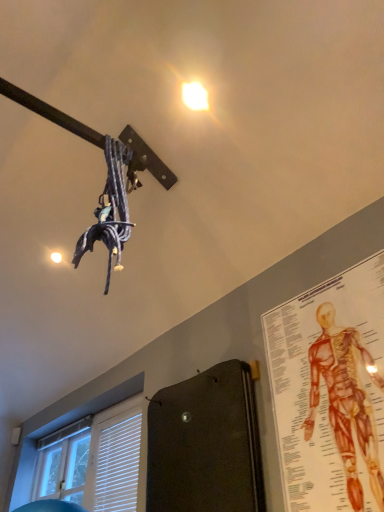
Question: Is white glossy droplight at upper center positioned in front of anatomical chart at upper right?

Choices:
 (A) no
 (B) yes

Answer: (A)

Question: From a real-world perspective, does white glossy droplight at upper center stand above anatomical chart at upper right?

Choices:
 (A) no
 (B) yes

Answer: (B)

Question: Is white glossy droplight at upper center wider than anatomical chart at upper right?

Choices:
 (A) yes
 (B) no

Answer: (A)

Question: Is white glossy droplight at upper center to the right of anatomical chart at upper right from the viewer's perspective?

Choices:
 (A) yes
 (B) no

Answer: (B)

Question: Considering the relative sizes of white glossy droplight at upper center and anatomical chart at upper right in the image provided, is white glossy droplight at upper center shorter than anatomical chart at upper right?

Choices:
 (A) yes
 (B) no

Answer: (A)

Question: Considering the positions of anatomical chart at upper right and white glossy droplight at upper center in the image, is anatomical chart at upper right taller or shorter than white glossy droplight at upper center?

Choices:
 (A) short
 (B) tall

Answer: (B)

Question: Considering the positions of anatomical chart at upper right and white glossy droplight at upper center in the image, is anatomical chart at upper right bigger or smaller than white glossy droplight at upper center?

Choices:
 (A) small
 (B) big

Answer: (B)

Question: Is anatomical chart at upper right in front of or behind white glossy droplight at upper center in the image?

Choices:
 (A) front
 (B) behind

Answer: (A)

Question: From the image's perspective, is anatomical chart at upper right above or below white glossy droplight at upper center?

Choices:
 (A) below
 (B) above

Answer: (A)

Question: Looking at their shapes, would you say white plastic blinds at lower left is wider or thinner than white glossy droplight at upper center?

Choices:
 (A) wide
 (B) thin

Answer: (B)

Question: Choose the correct answer: Is white plastic blinds at lower left inside white glossy droplight at upper center or outside it?

Choices:
 (A) inside
 (B) outside

Answer: (B)

Question: Visually, is white plastic blinds at lower left positioned to the left or to the right of white glossy droplight at upper center?

Choices:
 (A) right
 (B) left

Answer: (B)

Question: Based on their sizes in the image, would you say white plastic blinds at lower left is bigger or smaller than white glossy droplight at upper center?

Choices:
 (A) small
 (B) big

Answer: (B)

Question: In the image, is white glossy droplight at upper center on the left side or the right side of anatomical chart at upper right?

Choices:
 (A) left
 (B) right

Answer: (A)

Question: Based on their sizes in the image, would you say white glossy droplight at upper center is bigger or smaller than anatomical chart at upper right?

Choices:
 (A) small
 (B) big

Answer: (A)